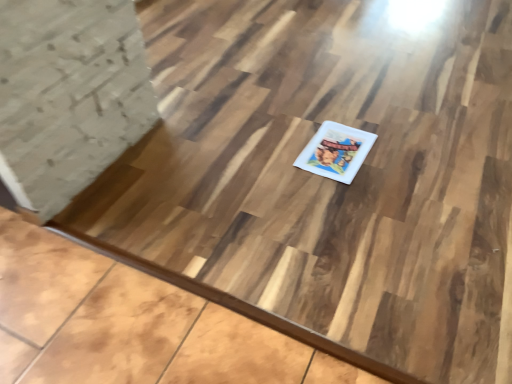
Find the location of `vacant area on top of white glossy book at center (from a real-world perspective)`. vacant area on top of white glossy book at center (from a real-world perspective) is located at coordinates (336, 147).